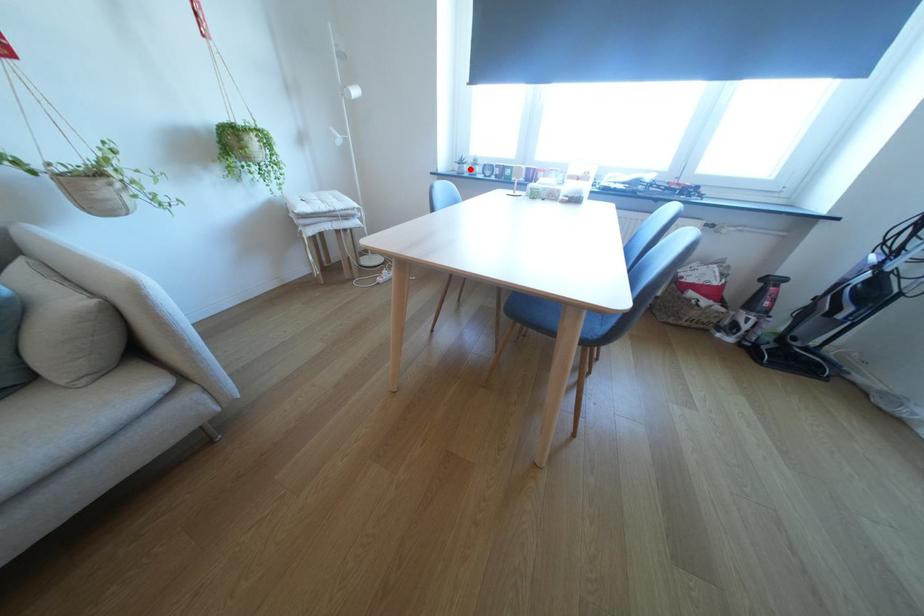
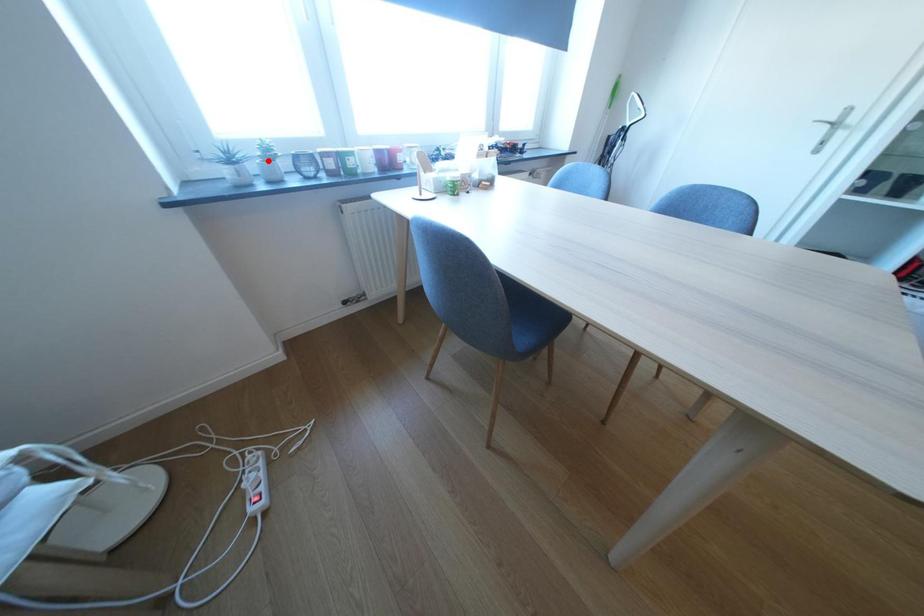
I am providing you with two images of the same scene from different viewpoints. A red point is marked on the first image and another point is marked on the second image. Does the point marked in image1 correspond to the same location as the one in image2?

No